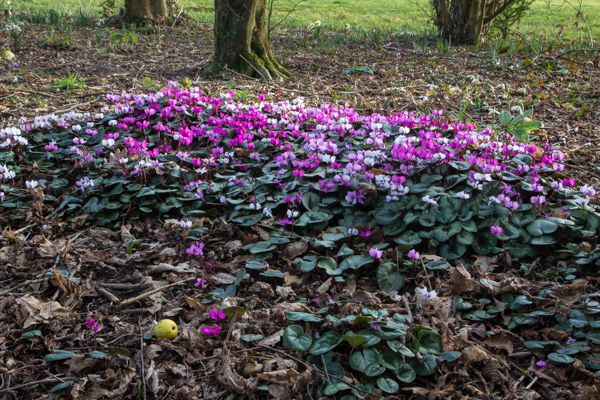
Where is `napkin`? Image resolution: width=600 pixels, height=400 pixels. napkin is located at coordinates (36, 308).